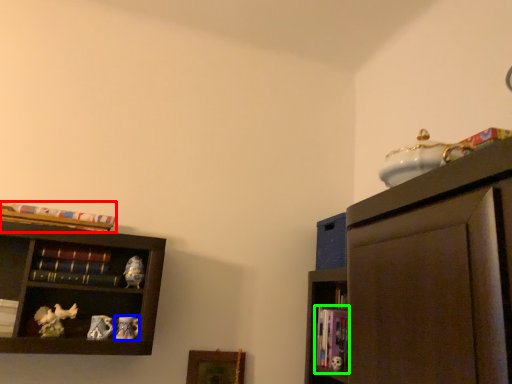
Question: Estimate the real-world distances between objects in this image. Which object is closer to book (highlighted by a red box), toy (highlighted by a blue box) or book (highlighted by a green box)?

Choices:
 (A) toy
 (B) book

Answer: (A)